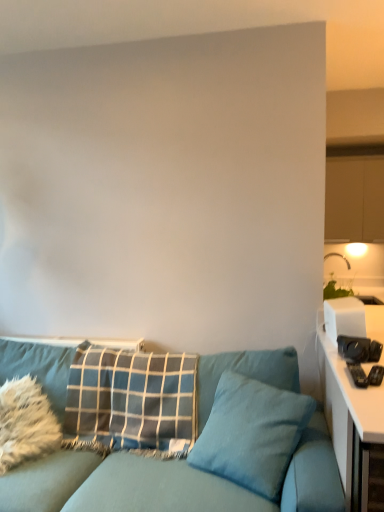
Question: Is blue plaid pillow at center, the 2th pillow from the left, at the left side of teal fabric pillow at center, arranged as the 1th pillow when viewed from the right?

Choices:
 (A) no
 (B) yes

Answer: (B)

Question: Is the depth of blue plaid pillow at center, the 2th pillow from the left, less than that of teal fabric pillow at center, which is the 3th pillow from left to right?

Choices:
 (A) no
 (B) yes

Answer: (A)

Question: Can you confirm if blue plaid pillow at center, the second pillow when ordered from right to left, is bigger than teal fabric pillow at center, arranged as the 1th pillow when viewed from the right?

Choices:
 (A) yes
 (B) no

Answer: (A)

Question: Does blue plaid pillow at center, the second pillow when ordered from right to left, have a smaller size compared to teal fabric pillow at center, arranged as the 1th pillow when viewed from the right?

Choices:
 (A) no
 (B) yes

Answer: (A)

Question: Does blue plaid pillow at center, the 2th pillow from the left, touch teal fabric pillow at center, which is the 3th pillow from left to right?

Choices:
 (A) no
 (B) yes

Answer: (A)

Question: From the image's perspective, is white glossy table at right above or below white plastic toaster at right?

Choices:
 (A) above
 (B) below

Answer: (B)

Question: Based on their positions, is white glossy table at right located to the left or right of white plastic toaster at right?

Choices:
 (A) right
 (B) left

Answer: (A)

Question: Considering the positions of white glossy table at right and white plastic toaster at right in the image, is white glossy table at right wider or thinner than white plastic toaster at right?

Choices:
 (A) thin
 (B) wide

Answer: (B)

Question: From their relative heights in the image, would you say white glossy table at right is taller or shorter than white plastic toaster at right?

Choices:
 (A) tall
 (B) short

Answer: (A)

Question: Considering the positions of white glossy table at right and teal fabric couch at lower left in the image, is white glossy table at right wider or thinner than teal fabric couch at lower left?

Choices:
 (A) thin
 (B) wide

Answer: (A)

Question: Is white glossy table at right taller or shorter than teal fabric couch at lower left?

Choices:
 (A) tall
 (B) short

Answer: (A)

Question: Is white glossy table at right in front of or behind teal fabric couch at lower left in the image?

Choices:
 (A) front
 (B) behind

Answer: (A)

Question: In terms of size, does white glossy table at right appear bigger or smaller than teal fabric couch at lower left?

Choices:
 (A) big
 (B) small

Answer: (A)

Question: Is white glossy table at right situated inside white fluffy pillow at lower left, marked as the third pillow in a right-to-left arrangement, or outside?

Choices:
 (A) outside
 (B) inside

Answer: (A)

Question: From a real-world perspective, is white glossy table at right positioned above or below white fluffy pillow at lower left, marked as the third pillow in a right-to-left arrangement?

Choices:
 (A) below
 (B) above

Answer: (A)